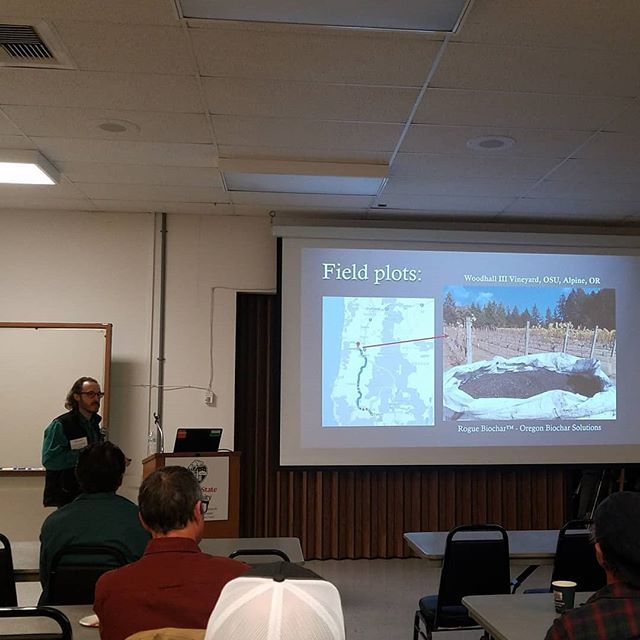
This screenshot has width=640, height=640. What are the coordinates of `white table` in the screenshot? It's located at (419, 539).